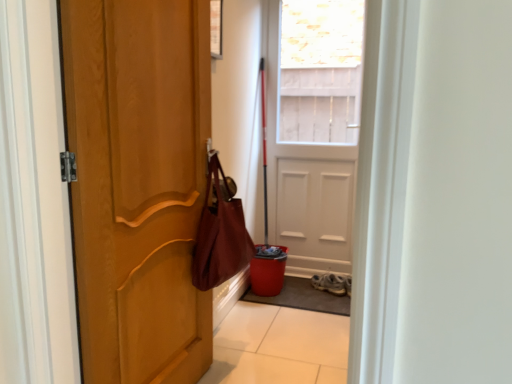
Find the location of a particular element. vacant space that is to the left of white leather sneakers at lower center is located at coordinates (313, 289).